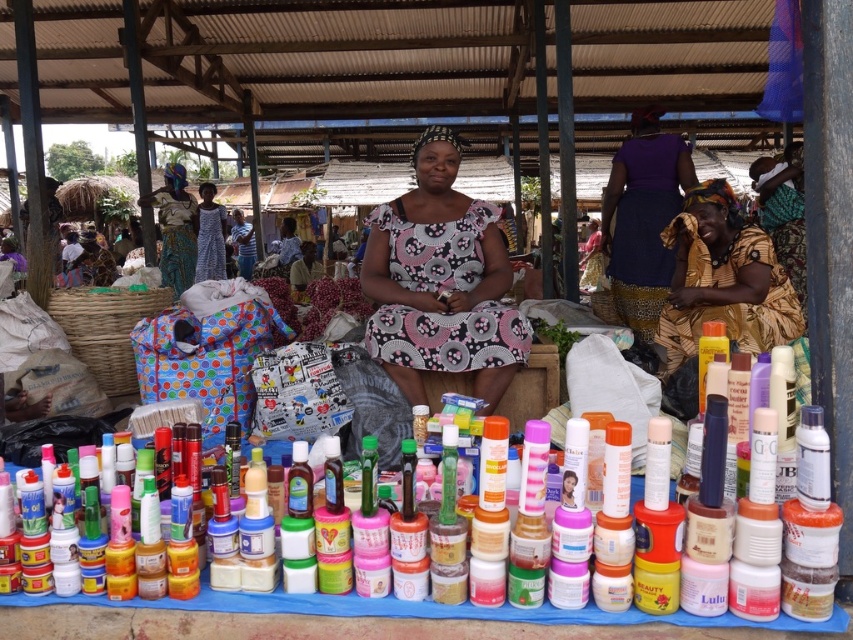
Between patterned fabric dress at center and matte blue dress at center, which one is positioned lower?

patterned fabric dress at center is below.

Is patterned fabric dress at center to the left of matte blue dress at center from the viewer's perspective?

In fact, patterned fabric dress at center is to the right of matte blue dress at center.

Locate an element on the screen. patterned fabric dress at center is located at coordinates coord(440,282).

Who is taller, patterned fabric dress at center or matte blue fabric headscarf at upper left?

matte blue fabric headscarf at upper left

Locate an element on the screen. patterned fabric dress at center is located at coordinates (440, 282).

Which is in front, point (477, 200) or point (161, 250)?

Point (477, 200) is more forward.

Locate an element on the screen. This screenshot has width=853, height=640. patterned fabric dress at center is located at coordinates (440, 282).

Who is higher up, patterned fabric dress at center or matte plastic bottles at center?

Positioned higher is patterned fabric dress at center.

Is point (459, 208) less distant than point (421, 612)?

No, it is not.

Is point (474, 304) farther from camera compared to point (463, 618)?

Yes.

Where is `patterned fabric dress at center`? The image size is (853, 640). patterned fabric dress at center is located at coordinates (440, 282).